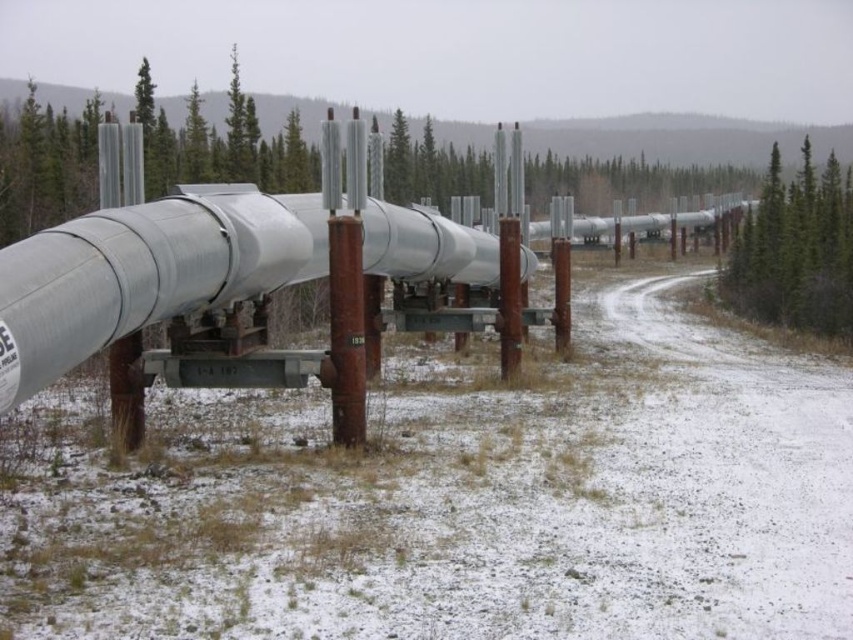
Is point (772, 269) farther from camera compared to point (247, 148)?

Yes, point (772, 269) is behind point (247, 148).

Which is below, green leafy tree at upper right or green textured pine tree at upper center?

green leafy tree at upper right is below.

Which is behind, point (807, 221) or point (235, 96)?

The point (807, 221) is behind.

Identify the location of green leafy tree at upper right. This screenshot has width=853, height=640. tap(795, 250).